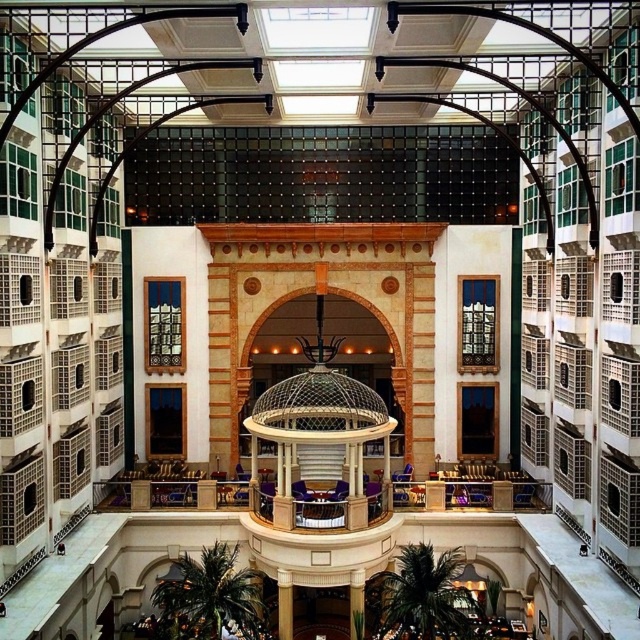
Question: Which of the following is the farthest from the observer?

Choices:
 (A) green marble pillar at center
 (B) golden polished column at center

Answer: (B)

Question: Is the position of golden polished column at center less distant than that of green marble pillar at center?

Choices:
 (A) yes
 (B) no

Answer: (B)

Question: Is golden polished column at center thinner than green marble pillar at center?

Choices:
 (A) yes
 (B) no

Answer: (A)

Question: Which object appears farthest from the camera in this image?

Choices:
 (A) golden polished column at center
 (B) green marble pillar at center

Answer: (A)

Question: Which point is farther to the camera?

Choices:
 (A) green marble pillar at center
 (B) golden polished column at center

Answer: (B)

Question: Is golden polished column at center bigger than green marble pillar at center?

Choices:
 (A) yes
 (B) no

Answer: (B)